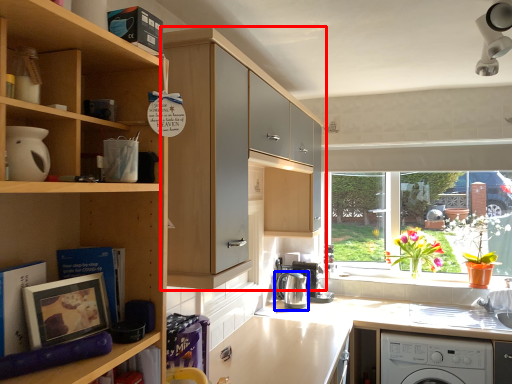
Question: Among these objects, which one is nearest to the camera, cabinetry (highlighted by a red box) or kitchen appliance (highlighted by a blue box)?

Choices:
 (A) cabinetry
 (B) kitchen appliance

Answer: (A)